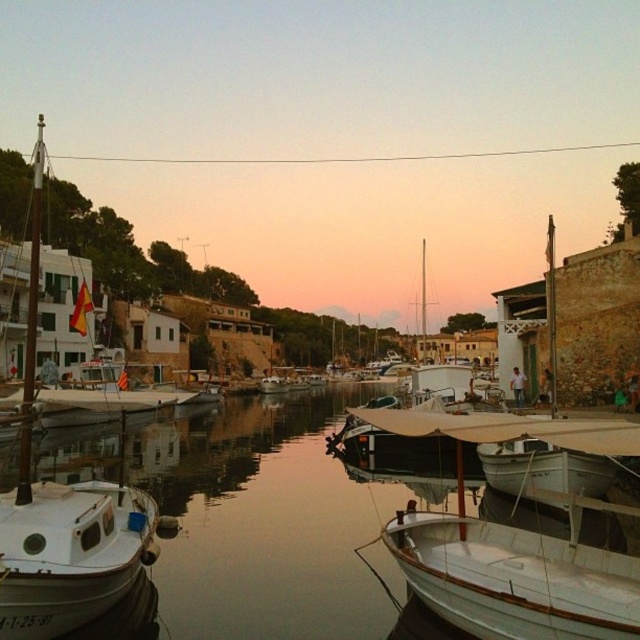
You are standing at the edge of the harbor looking out. There are two points marked in the scene, one at coordinates point (86, 602) and the other at point (464, 452). Which of these points is closer to you?

Point (86, 602) is closer to the viewer than point (464, 452).